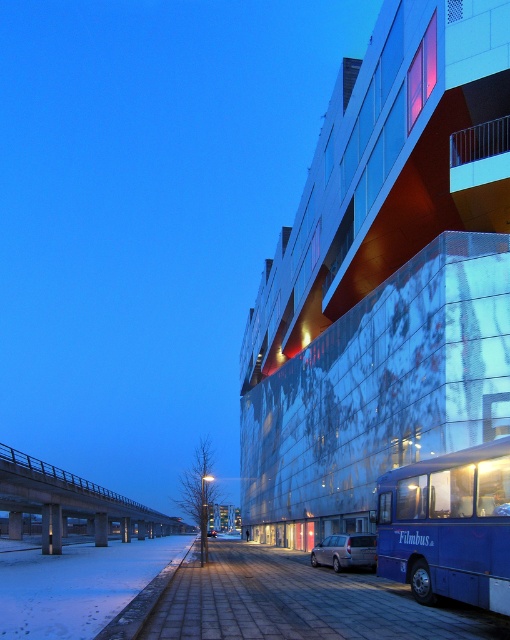
This screenshot has width=510, height=640. Describe the element at coordinates (448, 525) in the screenshot. I see `blue metallic bus at lower right` at that location.

Is blue metallic bus at lower right smaller than concrete bridge at lower left?

Yes.

Is point (415, 509) positioned in front of point (123, 500)?

Yes, it is in front of point (123, 500).

Locate an element on the screen. This screenshot has width=510, height=640. blue metallic bus at lower right is located at coordinates (448, 525).

Is point (341, 560) in front of point (207, 531)?

Yes.

Does silver metallic van at center come behind silver metallic car at center?

No, it is in front of silver metallic car at center.

Is point (324, 561) behind point (209, 532)?

No, it is in front of (209, 532).

Locate an element on the screen. This screenshot has width=510, height=640. silver metallic van at center is located at coordinates (345, 550).

Can you confirm if concrete bridge at lower left is smaller than silver metallic car at center?

No, concrete bridge at lower left is not smaller than silver metallic car at center.

Consider the image. Is concrete bridge at lower left positioned in front of silver metallic car at center?

Yes, it is in front of silver metallic car at center.

This screenshot has width=510, height=640. In order to click on concrete bridge at lower left in this screenshot , I will do `click(71, 502)`.

This screenshot has height=640, width=510. I want to click on concrete bridge at lower left, so click(71, 502).